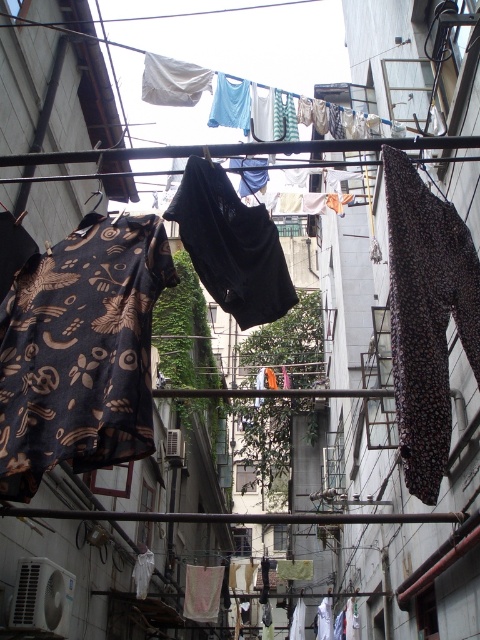
Question: Which point appears closest to the camera in this image?

Choices:
 (A) (83, 369)
 (B) (444, 444)

Answer: (B)

Question: Does brown printed fabric shirt at left appear on the left side of brown dotted fabric at right?

Choices:
 (A) no
 (B) yes

Answer: (B)

Question: Does brown printed fabric shirt at left have a larger size compared to brown dotted fabric at right?

Choices:
 (A) yes
 (B) no

Answer: (A)

Question: Which point appears farthest from the camera in this image?

Choices:
 (A) (23, 296)
 (B) (425, 433)

Answer: (A)

Question: Which point is farther to the camera?

Choices:
 (A) brown printed fabric shirt at left
 (B) brown dotted fabric at right

Answer: (A)

Question: Does brown printed fabric shirt at left come in front of brown dotted fabric at right?

Choices:
 (A) yes
 (B) no

Answer: (B)